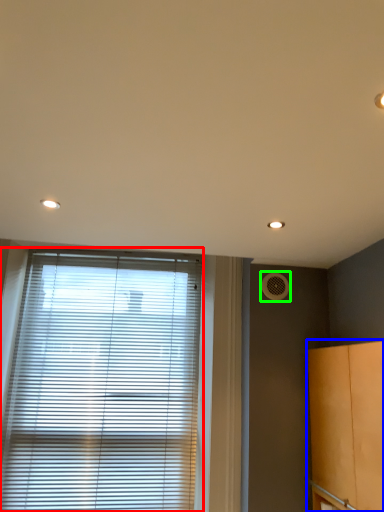
Question: Based on their relative distances, which object is nearer to window blind (highlighted by a red box)? Choose from cabinetry (highlighted by a blue box) and air conditioning (highlighted by a green box).

Choices:
 (A) cabinetry
 (B) air conditioning

Answer: (B)